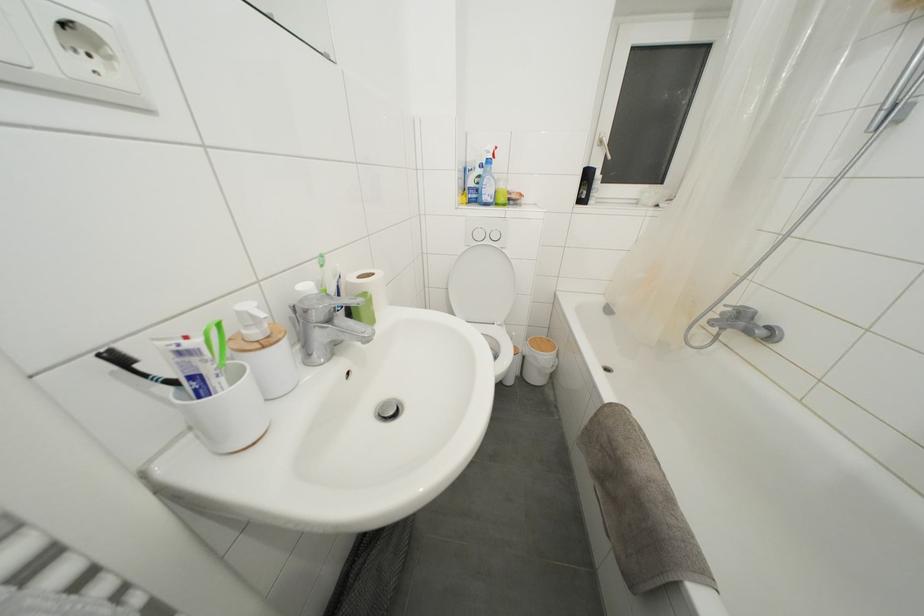
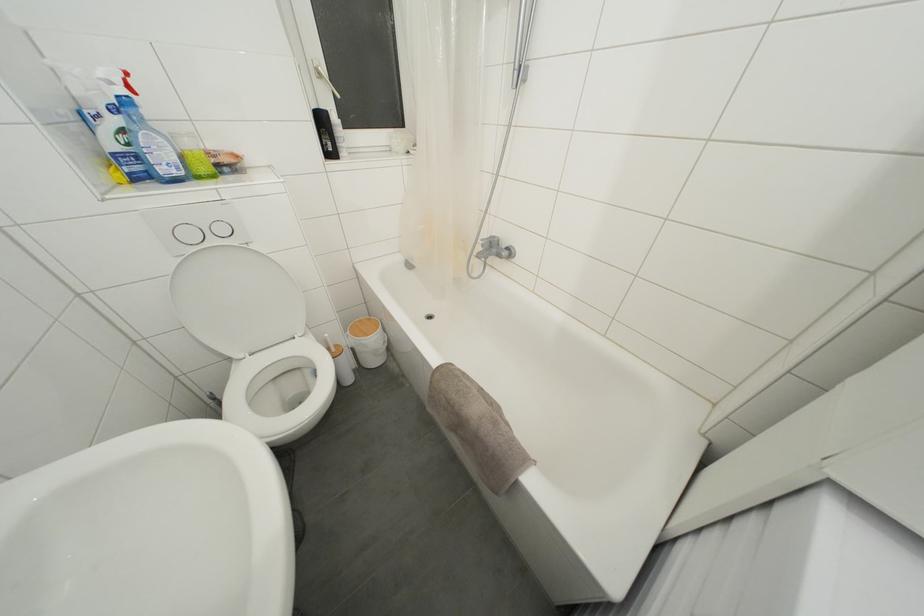
The point at (604, 148) is marked in the first image. Where is the corresponding point in the second image?

(323, 79)